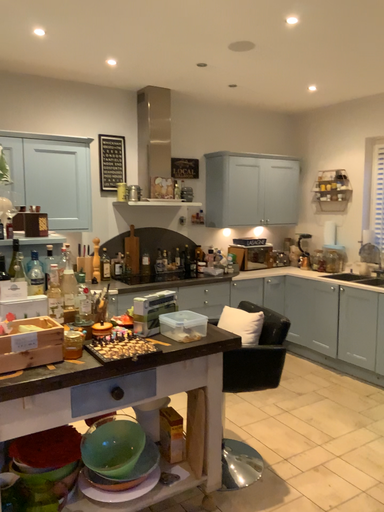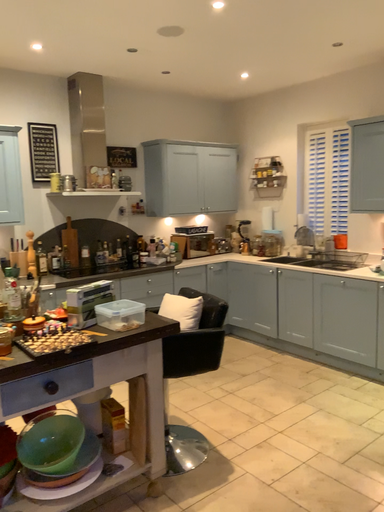
Question: How did the camera likely rotate when shooting the video?

Choices:
 (A) rotated left
 (B) rotated right

Answer: (B)